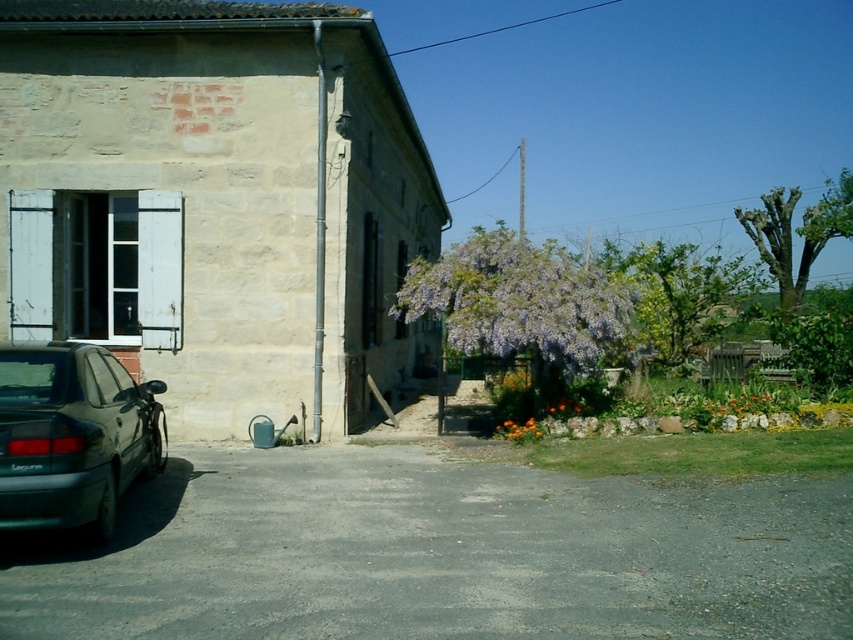
You are a visitor arriving at the stone building and notice the purple matte flowers at center and the green leafy tree at upper right. Which object is closer to the entrance of the building?

The purple matte flowers at center are closer to the entrance of the building because they are positioned on the left side of the green leafy tree at upper right, which places them nearer to the building compared to the tree located at the upper right corner.

You are standing in front of the stone building and want to place a small plant pot between the two points labeled point [496,234] and point [770,202]. Which point should the pot be closer to if you want it to be nearer to the camera?

The pot should be placed closer to point [496,234] because it is closer to the camera than point [770,202].